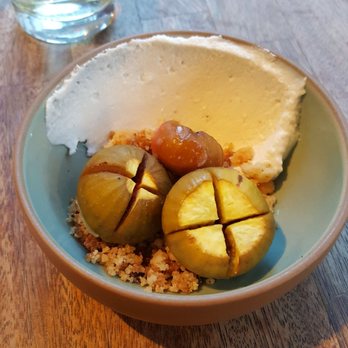
Locate an element on the screen. rough grain in table is located at coordinates (303, 314), (27, 234).